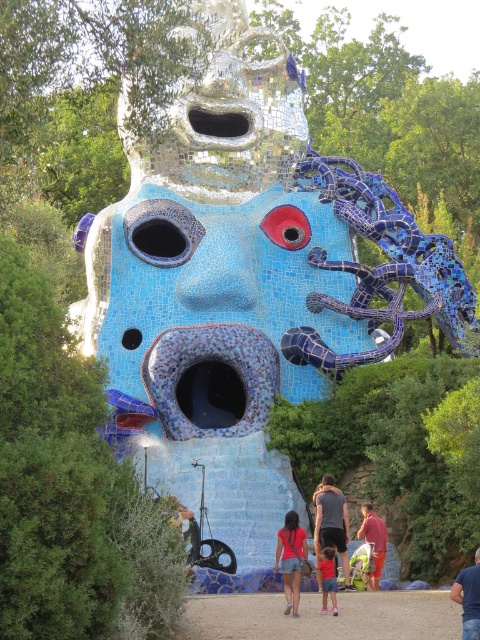
Between matte gray shirt at center and blue fabric at center, which one is positioned higher?

Positioned higher is matte gray shirt at center.

Does matte gray shirt at center have a greater height compared to blue fabric at center?

Yes, matte gray shirt at center is taller than blue fabric at center.

The image size is (480, 640). I want to click on matte gray shirt at center, so click(332, 522).

Which of these two, blue mosaic eye at center or shiny metallic eye at upper center, stands taller?

blue mosaic eye at center is taller.

Is blue mosaic eye at center wider than shiny metallic eye at upper center?

No, blue mosaic eye at center is not wider than shiny metallic eye at upper center.

The image size is (480, 640). Describe the element at coordinates (162, 230) in the screenshot. I see `blue mosaic eye at center` at that location.

I want to click on blue mosaic eye at center, so click(x=162, y=230).

Can you confirm if blue mosaic eye at center is positioned to the left of matte blue mosaic eye at center?

Indeed, blue mosaic eye at center is positioned on the left side of matte blue mosaic eye at center.

Does blue mosaic eye at center appear under matte blue mosaic eye at center?

Yes, blue mosaic eye at center is below matte blue mosaic eye at center.

Does point (182, 216) lie in front of point (302, 220)?

Yes, it is in front of point (302, 220).

Locate an element on the screen. This screenshot has height=640, width=480. blue mosaic eye at center is located at coordinates (162, 230).